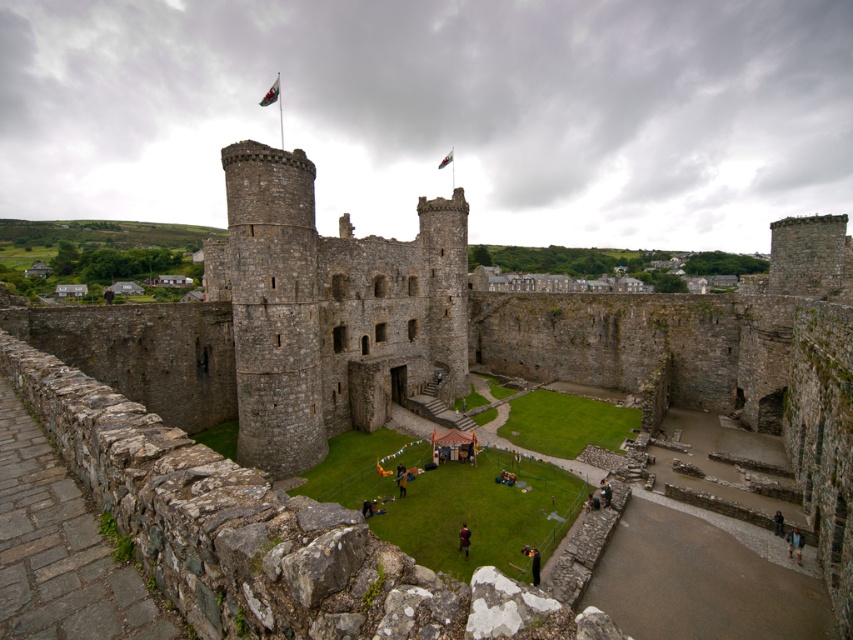
Question: Which point is closer to the camera?

Choices:
 (A) light brown leather jacket at lower right
 (B) dark brown leather jacket at center
 (C) dark blue fabric at lower right
 (D) green fabric flag at center

Answer: (B)

Question: Is dark brown leather jacket at center below green fabric flag at center?

Choices:
 (A) yes
 (B) no

Answer: (A)

Question: Which object is farther from the camera taking this photo?

Choices:
 (A) dark blue fabric at lower right
 (B) dark brown leather jacket at center
 (C) green fabric flag at upper center
 (D) dark blue fabric at center

Answer: (C)

Question: Is the position of light brown leather jacket at lower right less distant than that of green fabric flag at center?

Choices:
 (A) no
 (B) yes

Answer: (B)

Question: Which point is closer to the camera?

Choices:
 (A) dark blue fabric at center
 (B) dark blue fabric at lower right
 (C) light brown leather jacket at lower right

Answer: (C)

Question: Does light brown leather jacket at lower right appear over green fabric flag at upper center?

Choices:
 (A) yes
 (B) no

Answer: (B)